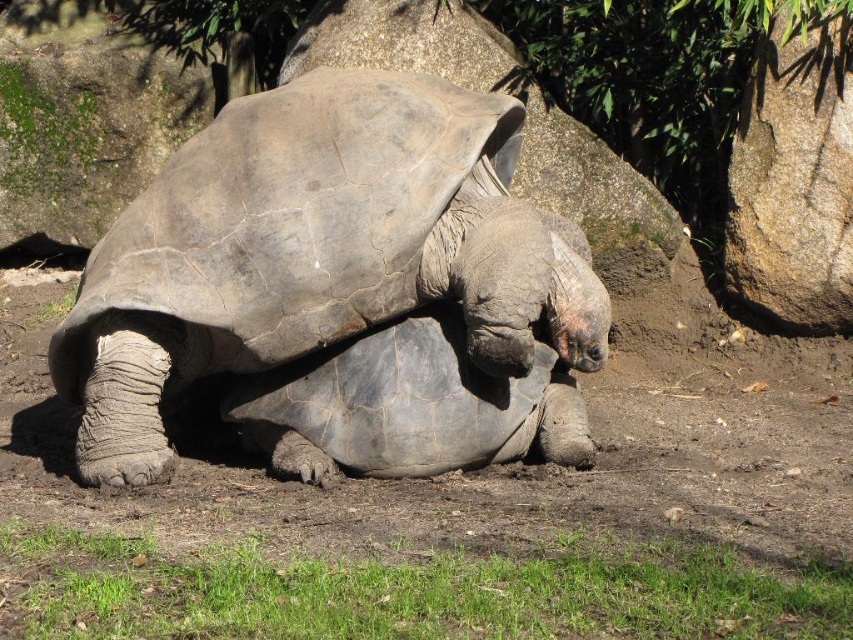
Looking at this image, between brown rough rock at right and gray rough stone at upper center, which one is positioned lower?

brown rough rock at right

Is brown rough rock at right bigger than gray rough stone at upper center?

Actually, brown rough rock at right might be smaller than gray rough stone at upper center.

Who is more forward, [833,157] or [412,52]?

Positioned in front is point [833,157].

The width and height of the screenshot is (853, 640). In order to click on brown rough rock at right in this screenshot , I will do `click(793, 170)`.

Can you confirm if gray textured tortoise at center is bigger than green grass at lower center?

Correct, gray textured tortoise at center is larger in size than green grass at lower center.

Who is more distant from viewer, (502, 305) or (28, 621)?

Positioned behind is point (502, 305).

What do you see at coordinates (316, 252) in the screenshot?
I see `gray textured tortoise at center` at bounding box center [316, 252].

I want to click on gray textured tortoise at center, so click(x=316, y=252).

Locate an element on the screen. gray textured tortoise at center is located at coordinates (316, 252).

Can you confirm if gray textured tortoise at center is thinner than brown rough rock at right?

No, gray textured tortoise at center is not thinner than brown rough rock at right.

What do you see at coordinates (316, 252) in the screenshot? I see `gray textured tortoise at center` at bounding box center [316, 252].

At what (x,y) coordinates should I click in order to perform the action: click on gray textured tortoise at center. Please return your answer as a coordinate pair (x, y). The width and height of the screenshot is (853, 640). Looking at the image, I should click on (316, 252).